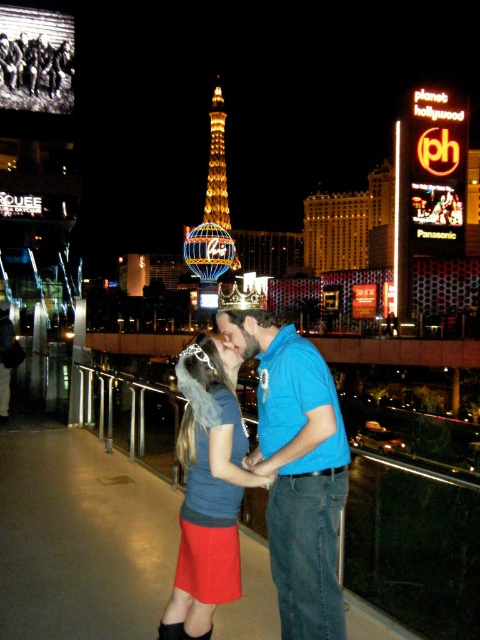
Which is in front, point (247, 317) or point (231, 240)?

Point (247, 317) is in front.

You are a GUI agent. You are given a task and a screenshot of the screen. Output one action in this format:
    pyautogui.click(x=<x>, y=<y>)
    Task: Click on the blue cotton shirt at center
    This screenshot has height=640, width=480.
    Given the screenshot: What is the action you would take?
    pyautogui.click(x=297, y=470)

Identify the location of blue cotton shirt at center. This screenshot has height=640, width=480. [x=297, y=470].

Who is higher up, matte red skirt at center or blue illuminated tower at center?

blue illuminated tower at center is above.

Image resolution: width=480 pixels, height=640 pixels. Describe the element at coordinates (208, 532) in the screenshot. I see `matte red skirt at center` at that location.

This screenshot has width=480, height=640. What are the coordinates of `matte red skirt at center` in the screenshot? It's located at (208, 532).

Can you confirm if denim skirt at center is positioned below blue illuminated tower at center?

Yes.

Identify the location of denim skirt at center. This screenshot has width=480, height=640. (x=207, y=490).